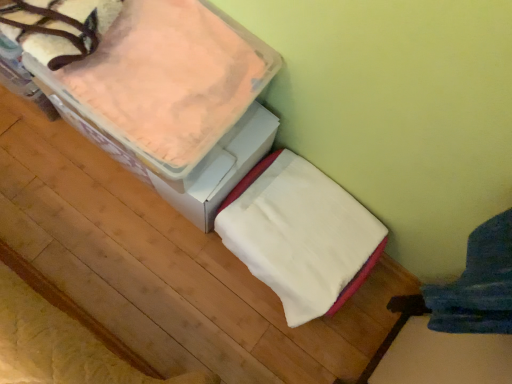
I want to click on vacant region above white soft blanket at center (from a real-world perspective), so click(x=309, y=232).